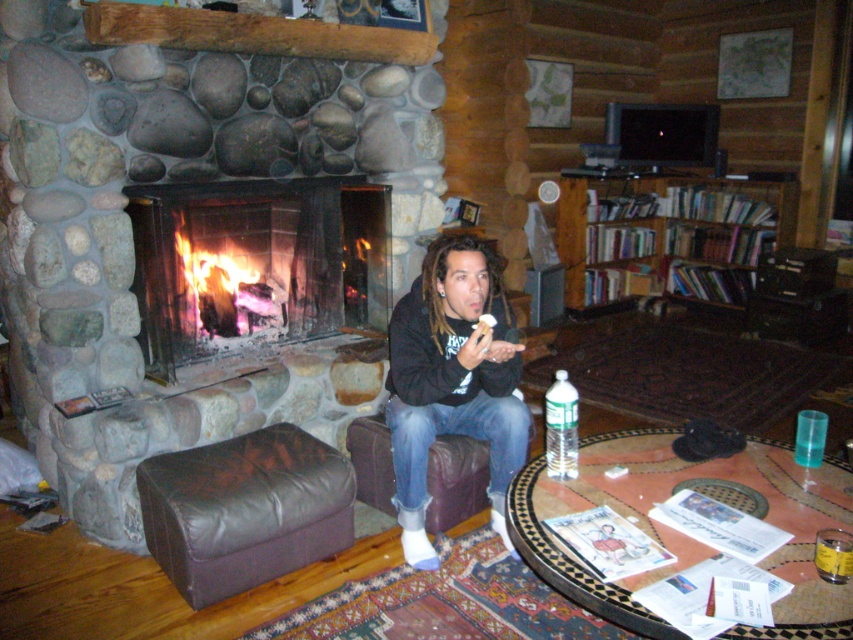
Based on the photo, you are a guest in this cabin and want to place your clear plastic water bottle at lower right on top of the black fleece jacket at center. Is this possible based on their sizes?

The black fleece jacket at center is much taller than the clear plastic water bottle at lower right, so placing the bottle on top of the jacket is possible as the jacket provides a stable base.

In the scene shown: You are standing in the living room and want to grab the clear plastic water bottle at lower right. However, the wooden bookshelf at upper right is blocking your path. Can you reach the water bottle without moving the bookshelf?

The clear plastic water bottle at lower right is behind the wooden bookshelf at upper right, so you can reach it without moving the bookshelf because it is positioned behind it and accessible from the other side.